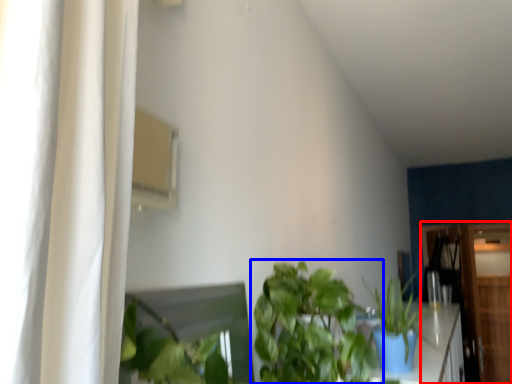
Question: Among these objects, which one is nearest to the camera, dresser (highlighted by a red box) or houseplant (highlighted by a blue box)?

Choices:
 (A) dresser
 (B) houseplant

Answer: (B)